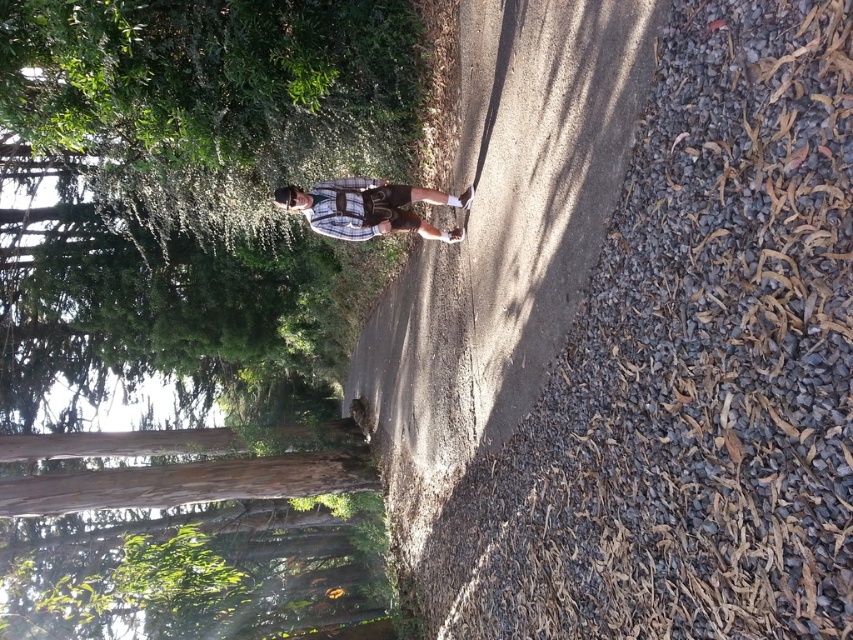
Question: Which point is closer to the camera taking this photo?

Choices:
 (A) (148, 60)
 (B) (318, 195)

Answer: (A)

Question: Is green leafy tree at center below plaid fabric shirt at center?

Choices:
 (A) no
 (B) yes

Answer: (B)

Question: Considering the relative positions of green leafy tree at center and plaid fabric shirt at center in the image provided, where is green leafy tree at center located with respect to plaid fabric shirt at center?

Choices:
 (A) left
 (B) right

Answer: (A)

Question: Which point is closer to the camera?

Choices:
 (A) green leafy tree at center
 (B) plaid fabric shirt at center

Answer: (A)

Question: Observing the image, what is the correct spatial positioning of green leafy tree at center in reference to plaid fabric shirt at center?

Choices:
 (A) below
 (B) above

Answer: (A)

Question: Which object is farther from the camera taking this photo?

Choices:
 (A) plaid fabric shirt at center
 (B) green leafy tree at center

Answer: (A)